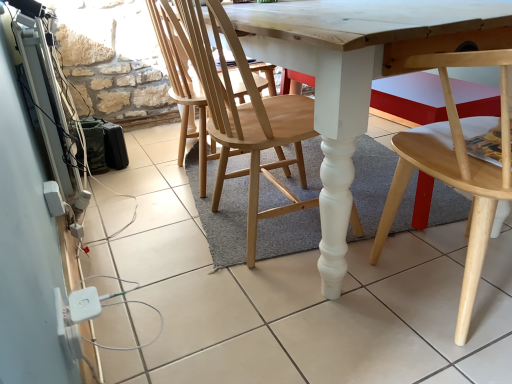
Question: Based on their sizes in the image, would you say natural wood chair at center, the 2th chair when ordered from right to left, is bigger or smaller than light wood chair at lower right, the first chair in the right-to-left sequence?

Choices:
 (A) small
 (B) big

Answer: (A)

Question: Is natural wood chair at center, marked as the 1th chair in a left-to-right arrangement, inside the boundaries of light wood chair at lower right, the first chair in the right-to-left sequence, or outside?

Choices:
 (A) outside
 (B) inside

Answer: (A)

Question: In terms of height, does natural wood chair at center, marked as the 1th chair in a left-to-right arrangement, look taller or shorter compared to light wood chair at lower right, the first chair in the right-to-left sequence?

Choices:
 (A) short
 (B) tall

Answer: (B)

Question: Would you say light wood chair at lower right, the first chair in the right-to-left sequence, is to the left or to the right of natural wood chair at center, marked as the 1th chair in a left-to-right arrangement, in the picture?

Choices:
 (A) left
 (B) right

Answer: (B)

Question: Is light wood chair at lower right, which is the second chair in left-to-right order, inside the boundaries of natural wood chair at center, marked as the 1th chair in a left-to-right arrangement, or outside?

Choices:
 (A) outside
 (B) inside

Answer: (A)

Question: Considering the positions of light wood chair at lower right, which is the second chair in left-to-right order, and natural wood chair at center, marked as the 1th chair in a left-to-right arrangement, in the image, is light wood chair at lower right, which is the second chair in left-to-right order, taller or shorter than natural wood chair at center, marked as the 1th chair in a left-to-right arrangement,?

Choices:
 (A) short
 (B) tall

Answer: (A)

Question: Is point (443, 67) closer or farther from the camera than point (240, 54)?

Choices:
 (A) closer
 (B) farther

Answer: (A)